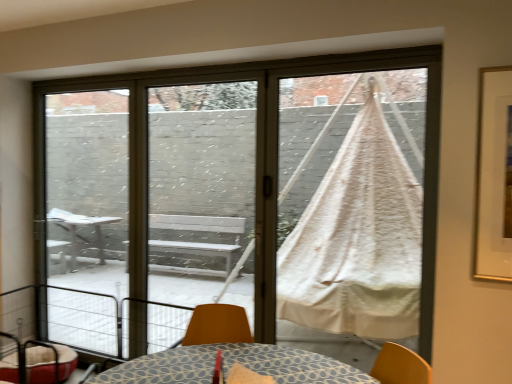
Question: Can white cotton hammock at right be found inside transparent glass screen door at center, positioned as the 1th screen door in right-to-left order?

Choices:
 (A) no
 (B) yes

Answer: (A)

Question: Is transparent glass screen door at center, positioned as the 2th screen door in left-to-right order, outside of white cotton hammock at right?

Choices:
 (A) no
 (B) yes

Answer: (B)

Question: Does transparent glass screen door at center, positioned as the 2th screen door in left-to-right order, have a lesser height compared to white cotton hammock at right?

Choices:
 (A) yes
 (B) no

Answer: (B)

Question: From the image's perspective, is transparent glass screen door at center, positioned as the 2th screen door in left-to-right order, beneath white cotton hammock at right?

Choices:
 (A) yes
 (B) no

Answer: (A)

Question: Is transparent glass screen door at center, positioned as the 2th screen door in left-to-right order, taller than white cotton hammock at right?

Choices:
 (A) no
 (B) yes

Answer: (B)

Question: Based on their sizes in the image, would you say transparent glass screen door at center, positioned as the 1th screen door in right-to-left order, is bigger or smaller than metallic wire balcony at lower left?

Choices:
 (A) big
 (B) small

Answer: (B)

Question: Looking at their shapes, would you say transparent glass screen door at center, positioned as the 2th screen door in left-to-right order, is wider or thinner than metallic wire balcony at lower left?

Choices:
 (A) thin
 (B) wide

Answer: (A)

Question: In the image, is transparent glass screen door at center, positioned as the 2th screen door in left-to-right order, positioned in front of or behind metallic wire balcony at lower left?

Choices:
 (A) behind
 (B) front

Answer: (A)

Question: Considering the relative positions of transparent glass screen door at center, positioned as the 1th screen door in right-to-left order, and metallic wire balcony at lower left in the image provided, is transparent glass screen door at center, positioned as the 1th screen door in right-to-left order, to the left or to the right of metallic wire balcony at lower left?

Choices:
 (A) left
 (B) right

Answer: (B)

Question: From the image's perspective, is white cotton hammock at right located above or below metallic wire balcony at lower left?

Choices:
 (A) above
 (B) below

Answer: (A)

Question: From a real-world perspective, relative to metallic wire balcony at lower left, is white cotton hammock at right vertically above or below?

Choices:
 (A) below
 (B) above

Answer: (B)

Question: Relative to metallic wire balcony at lower left, is white cotton hammock at right in front or behind?

Choices:
 (A) front
 (B) behind

Answer: (B)

Question: Is white cotton hammock at right spatially inside metallic wire balcony at lower left, or outside of it?

Choices:
 (A) inside
 (B) outside

Answer: (B)

Question: Considering their positions, is transparent glass screen door at center, positioned as the 2th screen door in left-to-right order, located in front of or behind white fabric hammock at center?

Choices:
 (A) behind
 (B) front

Answer: (A)

Question: From a real-world perspective, relative to white fabric hammock at center, is transparent glass screen door at center, positioned as the 2th screen door in left-to-right order, vertically above or below?

Choices:
 (A) below
 (B) above

Answer: (B)